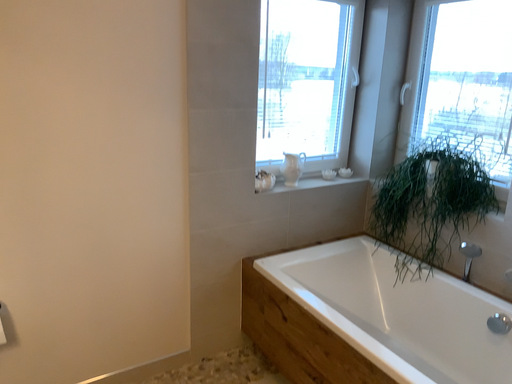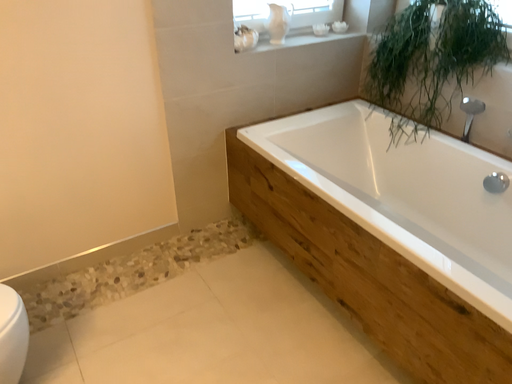
Question: How did the camera likely rotate when shooting the video?

Choices:
 (A) rotated downward
 (B) rotated upward

Answer: (A)